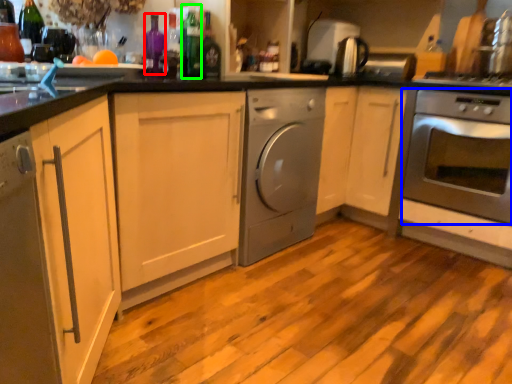
Question: Which is nearer to the bottle (highlighted by a red box)? oven (highlighted by a blue box) or bottle (highlighted by a green box).

Choices:
 (A) oven
 (B) bottle

Answer: (B)